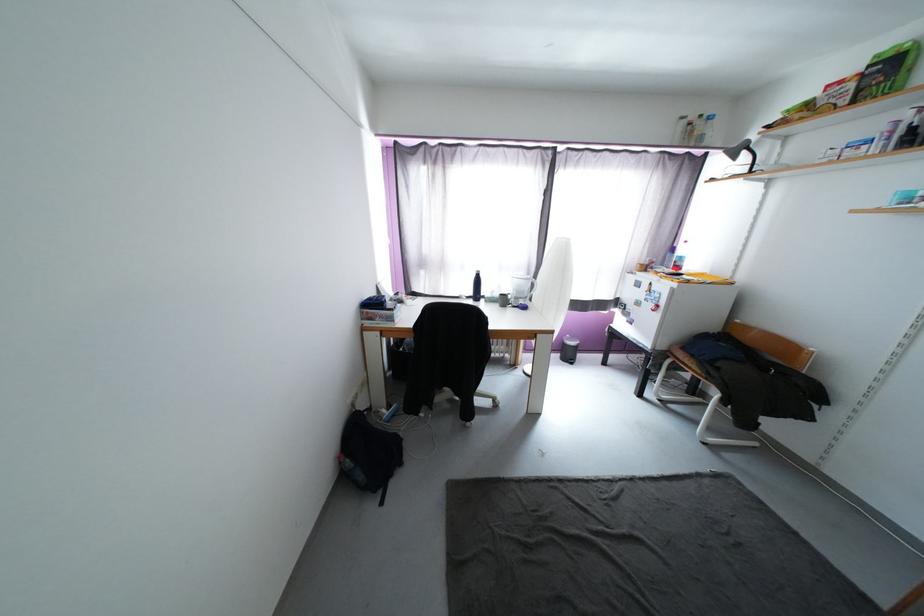
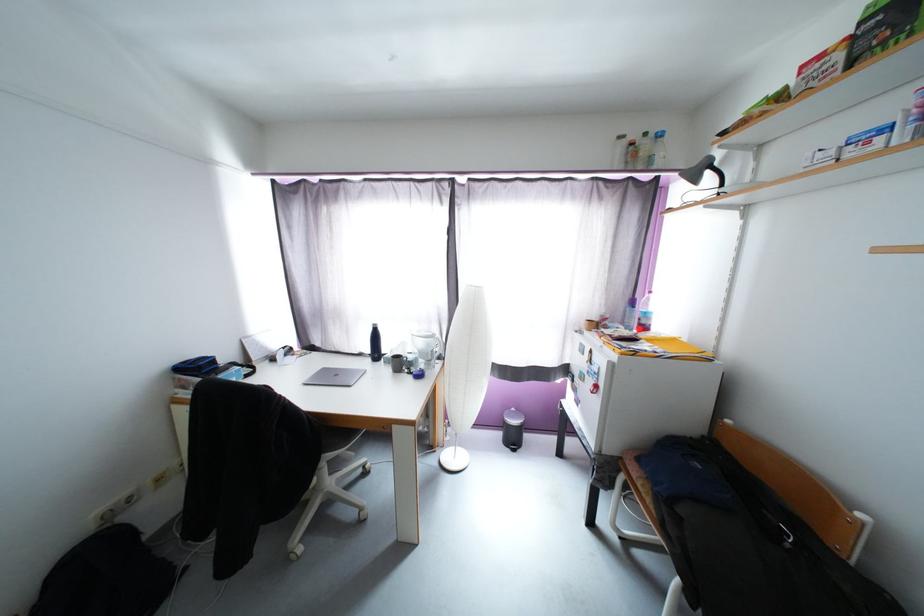
The point at (x=500, y=400) is marked in the first image. Where is the corresponding point in the second image?

(367, 511)